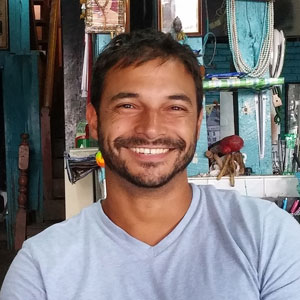
Locate an element on the screen. Image resolution: width=300 pixels, height=300 pixels. picture is located at coordinates (293, 24).